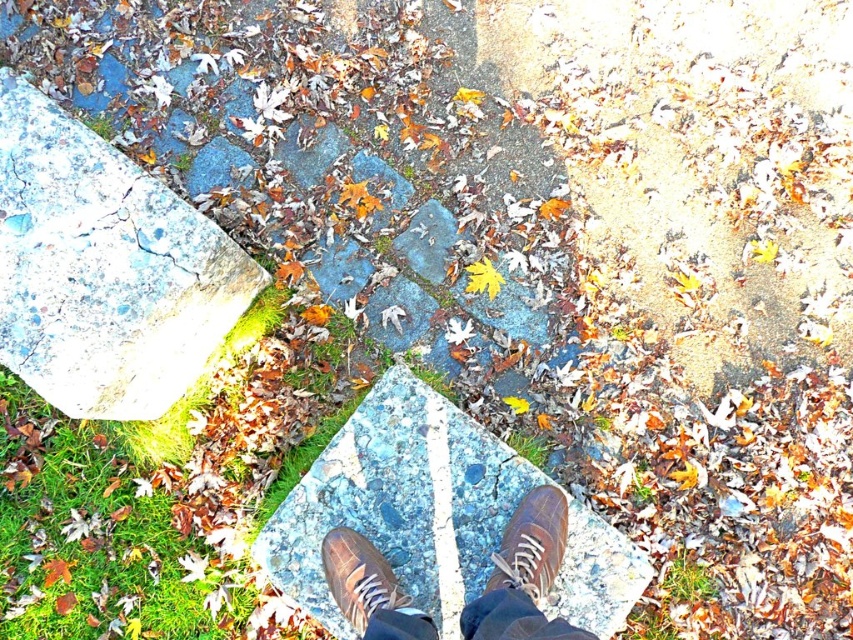
Who is positioned more to the left, brown leather shoe at center or brown suede shoe at center?

brown suede shoe at center is more to the left.

Where is `brown leather shoe at center`? The width and height of the screenshot is (853, 640). brown leather shoe at center is located at coordinates (531, 544).

Is point (556, 529) farther from camera compared to point (392, 600)?

Yes, it is behind point (392, 600).

In order to click on brown leather shoe at center in this screenshot , I will do `click(531, 544)`.

Is green mossy stone at lower left behind brown leather shoes at center?

That is True.

Between point (279, 497) and point (370, 614), which one is positioned in front?

Point (370, 614) is more forward.

I want to click on green mossy stone at lower left, so click(x=154, y=499).

Does green mossy stone at lower left lie in front of brown suede shoe at center?

No, it is behind brown suede shoe at center.

What do you see at coordinates (154, 499) in the screenshot? The height and width of the screenshot is (640, 853). I see `green mossy stone at lower left` at bounding box center [154, 499].

In order to click on green mossy stone at lower left in this screenshot , I will do `click(154, 499)`.